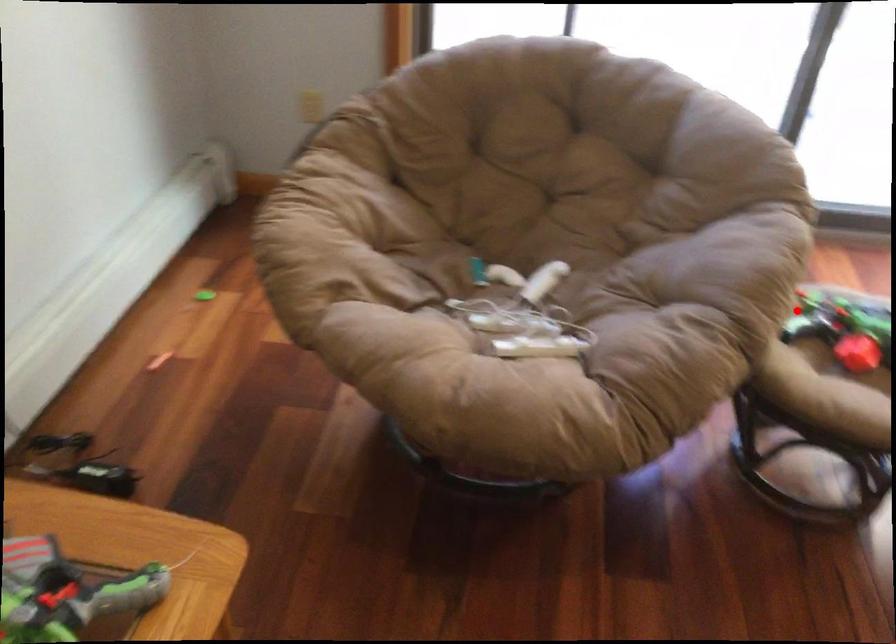
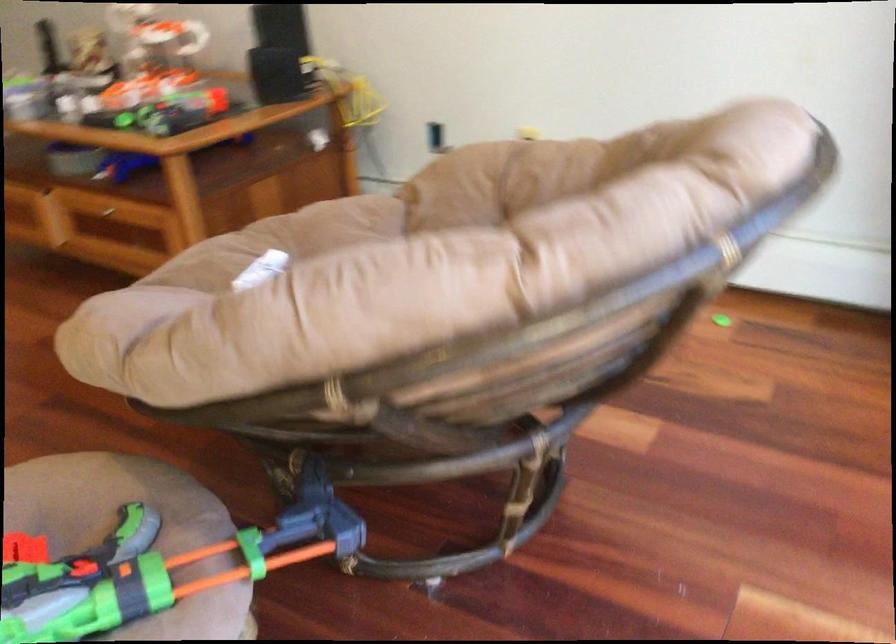
Question: I am providing you with two images of the same scene from different viewpoints. Given a red point in image1, look at the same physical point in image2. Is it:

Choices:
 (A) Closer to the viewpoint
 (B) Farther from the viewpoint

Answer: (A)